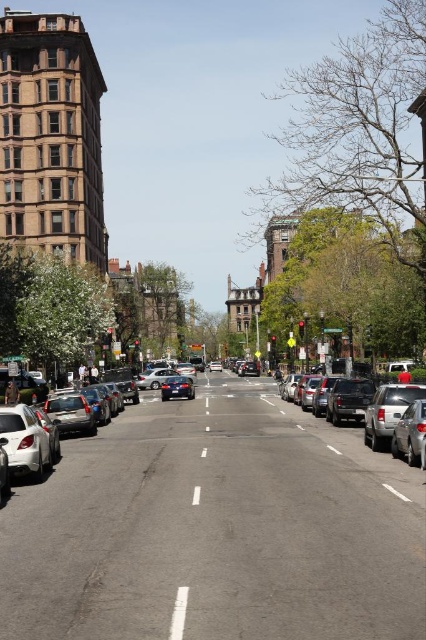
Question: Can you confirm if silver metallic sedan at right is positioned above white smooth line at center?

Choices:
 (A) yes
 (B) no

Answer: (A)

Question: Which object appears closest to the camera in this image?

Choices:
 (A) shiny silver sedan at center
 (B) silver metallic sedan at right

Answer: (B)

Question: Which object appears farthest from the camera in this image?

Choices:
 (A) silver metallic sedan at right
 (B) white smooth line at center

Answer: (A)

Question: Which object is the closest to the shiny silver sedan at center?

Choices:
 (A) white smooth line at center
 (B) silver metallic sedan at right

Answer: (B)

Question: Is silver metallic sedan at right positioned in front of white smooth line at center?

Choices:
 (A) no
 (B) yes

Answer: (A)

Question: Is silver metallic sedan at right thinner than white smooth line at center?

Choices:
 (A) yes
 (B) no

Answer: (B)